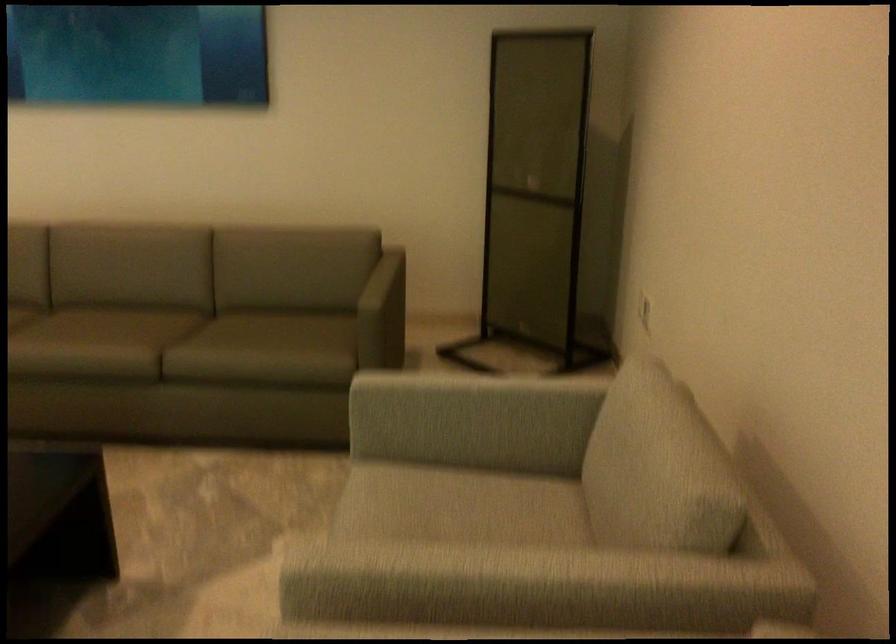
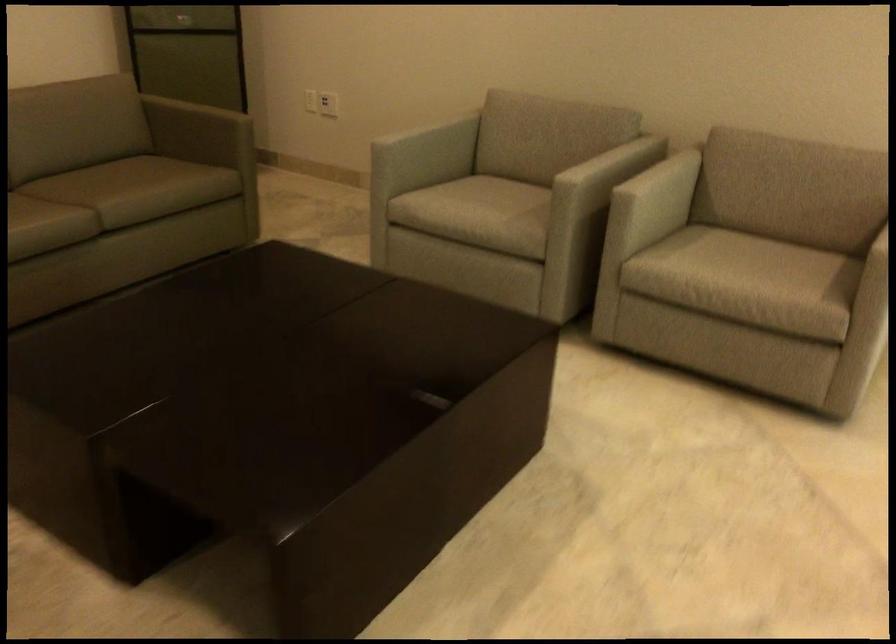
Where in the second image is the point corresponding to (x=222, y=357) from the first image?

(145, 187)